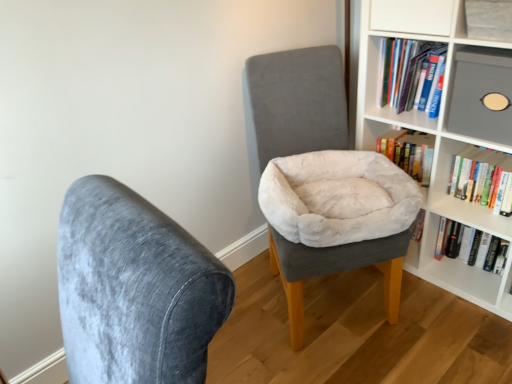
Image resolution: width=512 pixels, height=384 pixels. I want to click on vacant area situated below velvet gray chair at center, marked as the 1th chair in a back-to-front arrangement (from a real-world perspective), so click(x=344, y=305).